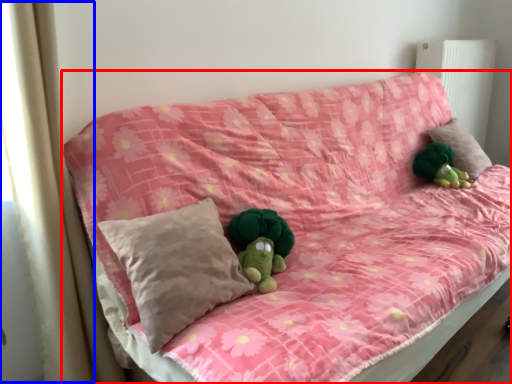
Question: Which point is closer to the camera, furniture (highlighted by a red box) or curtain (highlighted by a blue box)?

Choices:
 (A) furniture
 (B) curtain

Answer: (A)